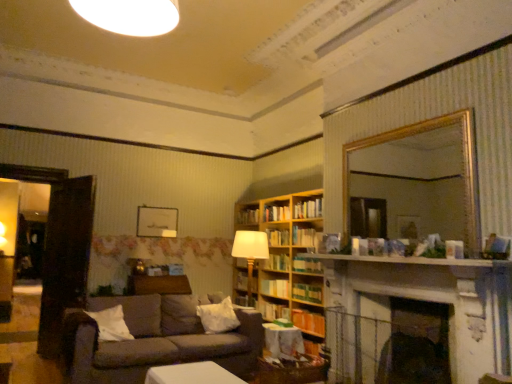
Question: From a real-world perspective, does hardcover book at center, placed as the fifth book when sorted from bottom to top, stand above hardcover book at center, marked as the fourth book in a bottom-to-top arrangement?

Choices:
 (A) no
 (B) yes

Answer: (A)

Question: Considering the relative sizes of hardcover book at center, placed as the fifth book when sorted from bottom to top, and hardcover book at center, marked as the fourth book in a bottom-to-top arrangement, in the image provided, is hardcover book at center, placed as the fifth book when sorted from bottom to top, wider than hardcover book at center, marked as the fourth book in a bottom-to-top arrangement,?

Choices:
 (A) yes
 (B) no

Answer: (B)

Question: Is the depth of hardcover book at center, which ranks as the 7th book in top-to-bottom order, greater than that of hardcover book at center, marked as the fourth book in a bottom-to-top arrangement?

Choices:
 (A) no
 (B) yes

Answer: (A)

Question: Is hardcover book at center, placed as the fifth book when sorted from bottom to top, surrounding hardcover book at center, marked as the fourth book in a bottom-to-top arrangement?

Choices:
 (A) yes
 (B) no

Answer: (B)

Question: Can you confirm if hardcover book at center, which ranks as the 7th book in top-to-bottom order, is bigger than hardcover book at center, marked as the fourth book in a bottom-to-top arrangement?

Choices:
 (A) yes
 (B) no

Answer: (B)

Question: Based on their positions, is white wooden mantle at upper center located to the left or right of hardcover book at center, arranged as the 3th book when viewed from the top?

Choices:
 (A) right
 (B) left

Answer: (A)

Question: Is white wooden mantle at upper center wider or thinner than hardcover book at center, arranged as the 9th book when ordered from the bottom?

Choices:
 (A) thin
 (B) wide

Answer: (B)

Question: From a real-world perspective, is white wooden mantle at upper center physically located above or below hardcover book at center, arranged as the 3th book when viewed from the top?

Choices:
 (A) above
 (B) below

Answer: (B)

Question: Considering their positions, is white wooden mantle at upper center located in front of or behind hardcover book at center, arranged as the 9th book when ordered from the bottom?

Choices:
 (A) behind
 (B) front

Answer: (B)

Question: Would you say gold-framed mirror at upper right is to the left or to the right of green matte bookshelf at center, which is the seventh book from bottom to top, in the picture?

Choices:
 (A) right
 (B) left

Answer: (A)

Question: Based on their sizes in the image, would you say gold-framed mirror at upper right is bigger or smaller than green matte bookshelf at center, which is counted as the 5th book, starting from the top?

Choices:
 (A) big
 (B) small

Answer: (A)

Question: In terms of width, does gold-framed mirror at upper right look wider or thinner when compared to green matte bookshelf at center, which is the seventh book from bottom to top?

Choices:
 (A) wide
 (B) thin

Answer: (B)

Question: Is gold-framed mirror at upper right in front of or behind green matte bookshelf at center, which is the seventh book from bottom to top, in the image?

Choices:
 (A) front
 (B) behind

Answer: (A)

Question: Do you think white glossy light fixture at upper center is within hardcover book at center, arranged as the 9th book when ordered from the bottom, or outside of it?

Choices:
 (A) inside
 (B) outside

Answer: (B)

Question: From the image's perspective, relative to hardcover book at center, arranged as the 9th book when ordered from the bottom, is white glossy light fixture at upper center above or below?

Choices:
 (A) below
 (B) above

Answer: (B)